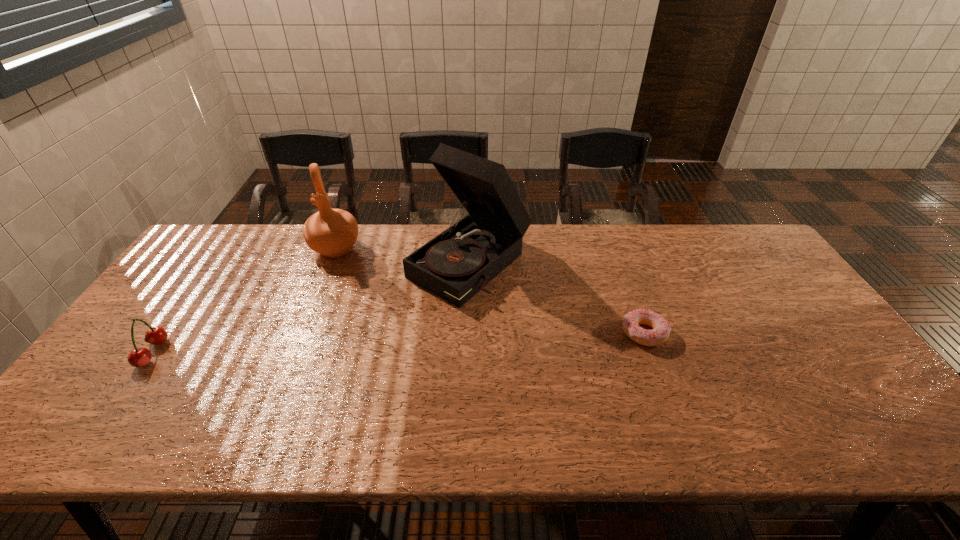
Where is `free space at the near edge of the desktop`? The width and height of the screenshot is (960, 540). free space at the near edge of the desktop is located at coordinates (762, 405).

Locate an element on the screen. The width and height of the screenshot is (960, 540). free space at the left edge is located at coordinates (144, 347).

Where is `vacant space at the near left corner of the desktop`? vacant space at the near left corner of the desktop is located at coordinates (144, 403).

Locate an element on the screen. This screenshot has height=540, width=960. free space between the cherry and the doughnut is located at coordinates (398, 343).

Where is `vacant area that lies between the doughnut and the third object from left to right`? The width and height of the screenshot is (960, 540). vacant area that lies between the doughnut and the third object from left to right is located at coordinates (558, 298).

Where is `free space that is in between the second tallest object and the tallest object`? The image size is (960, 540). free space that is in between the second tallest object and the tallest object is located at coordinates click(x=403, y=255).

Image resolution: width=960 pixels, height=540 pixels. I want to click on vacant point located between the second object from left to right and the doughnut, so click(491, 291).

At what (x,y) coordinates should I click in order to perform the action: click on free space between the second tallest object and the phonograph_record. Please return your answer as a coordinate pair (x, y). This screenshot has height=540, width=960. Looking at the image, I should click on (403, 255).

You are a GUI agent. You are given a task and a screenshot of the screen. Output one action in this format:
    pyautogui.click(x=<x>, y=<y>)
    Task: Click on the vacant space that is in between the tallest object and the shortest object
    
    Given the screenshot: What is the action you would take?
    click(558, 298)

Where is `vacant space that's between the third shortest object and the second shortest object`? This screenshot has width=960, height=540. vacant space that's between the third shortest object and the second shortest object is located at coordinates (244, 301).